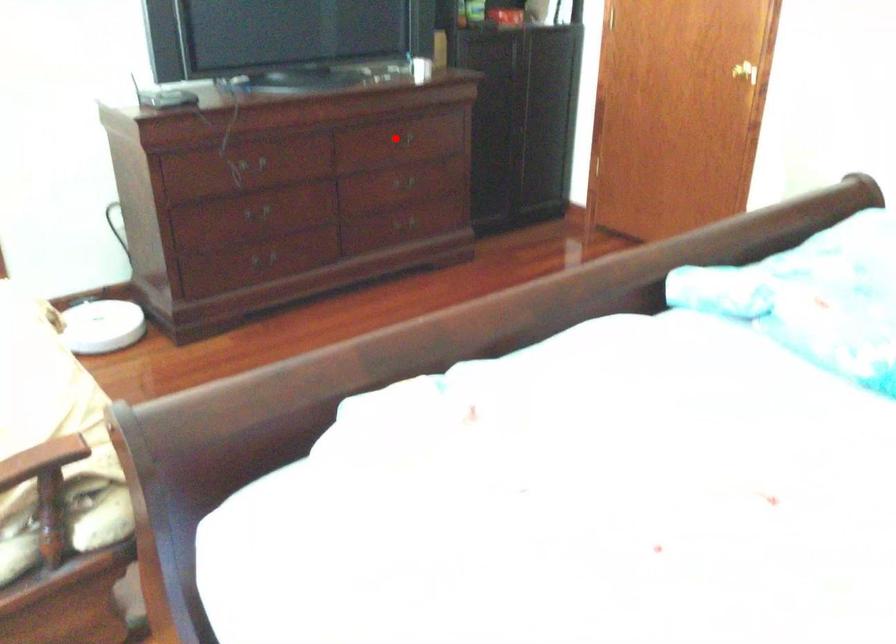
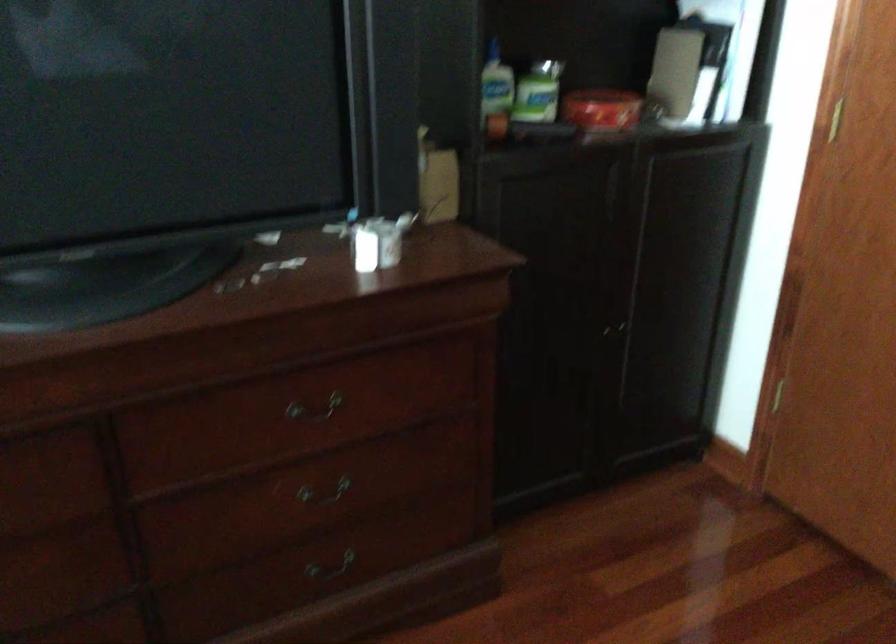
The point at the highlighted location is marked in the first image. Where is the corresponding point in the second image?

(314, 409)